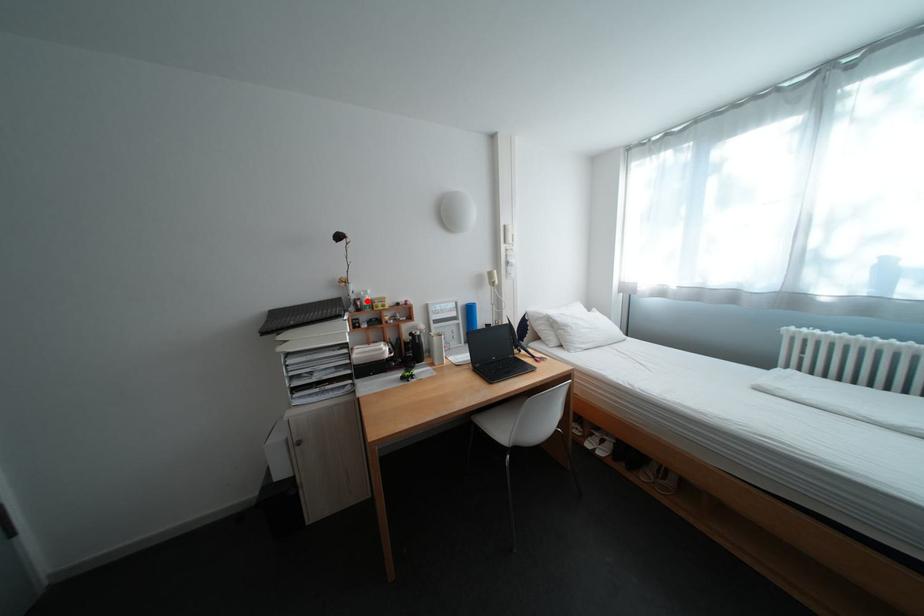
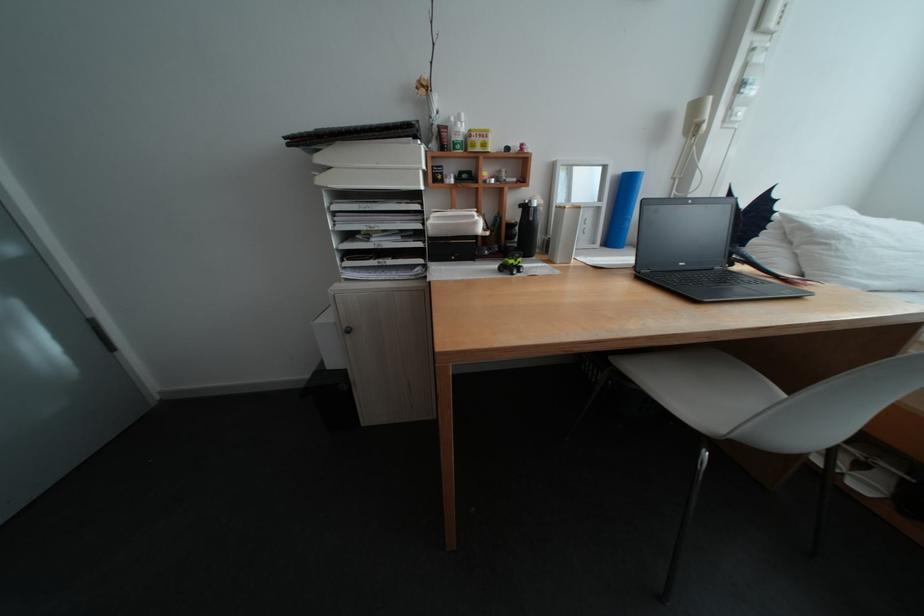
Find the pixel in the second image that matches the highlighted location in the first image.

(453, 128)